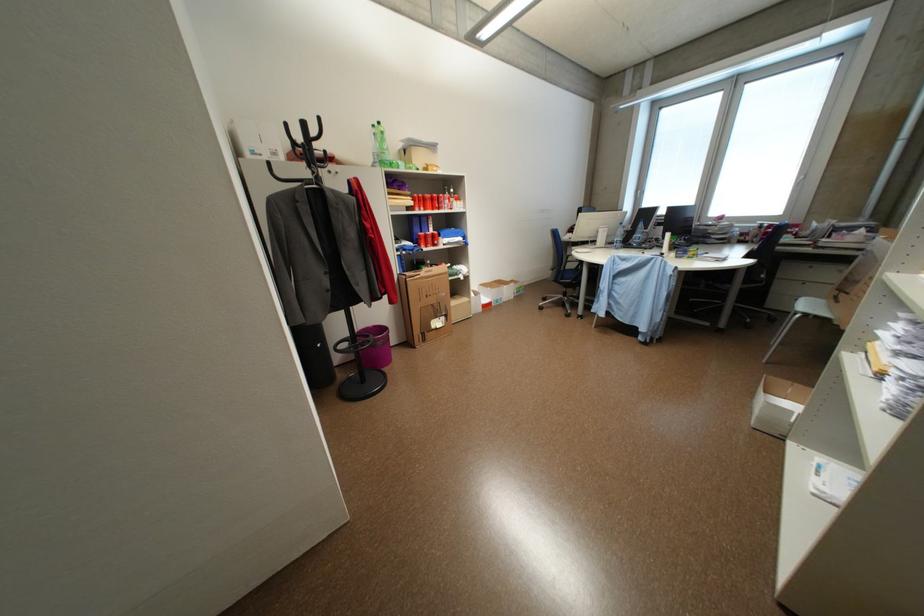
Where is `pink wastebasket`? pink wastebasket is located at coordinates (375, 346).